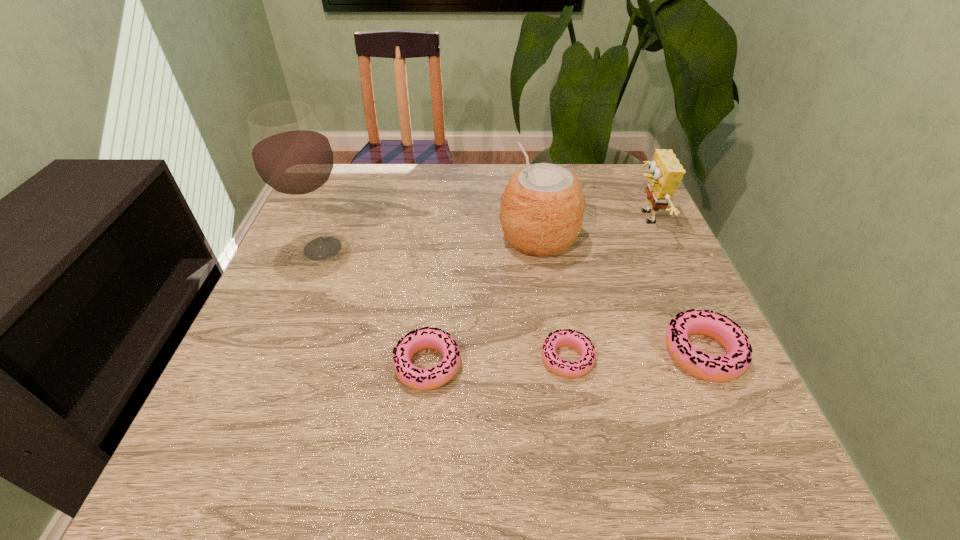
The doughnuts are evenly distributed in the image. To maintain this, where would you place another doughnut on the left? Please point to a free space. Please provide its 2D coordinates. Your answer should be formatted as a tuple, i.e. [(x, y)], where the tuple contains the x and y coordinates of a point satisfying the conditions above.

[(285, 372)]